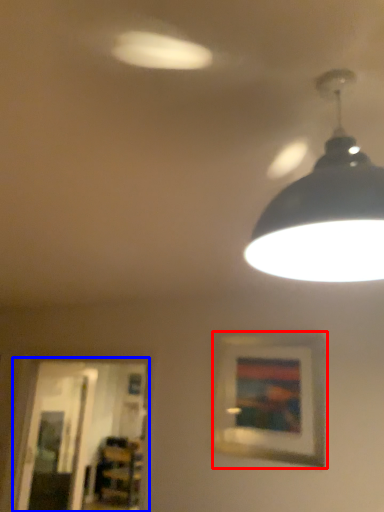
Question: Among these objects, which one is nearest to the camera, picture frame (highlighted by a red box) or glass door (highlighted by a blue box)?

Choices:
 (A) picture frame
 (B) glass door

Answer: (A)